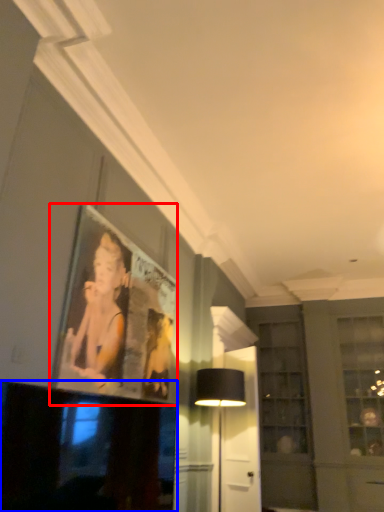
Question: Which object is further to the camera taking this photo, picture frame (highlighted by a red box) or television (highlighted by a blue box)?

Choices:
 (A) picture frame
 (B) television

Answer: (A)